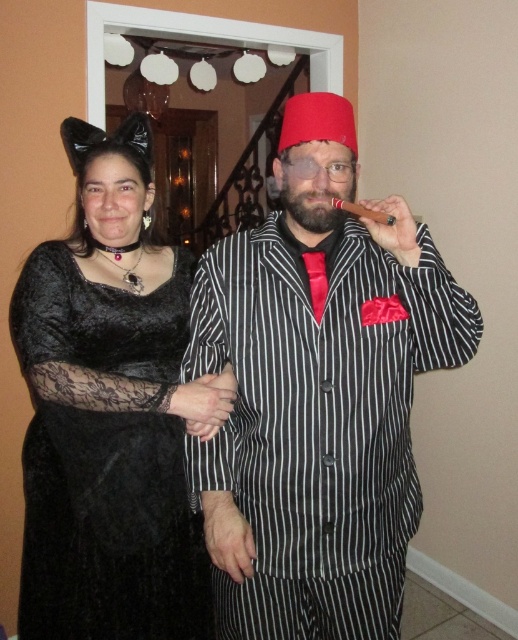
You are a photographer at a costume party and want to take a photo of both the matte black pinstripe suit at center and the velvet black dress at center. Which costume should you focus on first to ensure it appears sharp in the photo?

The matte black pinstripe suit at center is closer to the viewer than the velvet black dress at center, so you should focus on the matte black pinstripe suit at center first to ensure it appears sharp.

You are a photographer setting up for a photoshoot. You need to position two models wearing the matte black pinstripe suit at center and the velvet black dress at center so that both fit comfortably within a 2.5 meter wide frame. Given the information about their clothing widths, which model should stand closer to the edge of the frame to ensure both fit?

The matte black pinstripe suit at center is wider than the velvet black dress at center. To fit both within the 2.5 meter frame, the wider matte black pinstripe suit at center should be positioned closer to the center, while the narrower velvet black dress at center can be placed near the edge. This arrangement ensures both fit comfortably within the frame.

You are at a costume party and need to decide which costume is lower. You see a matte black pinstripe suit at center and a velvet black dress at center. Which one is positioned lower?

Answer: The matte black pinstripe suit at center is positioned lower than the velvet black dress at center.